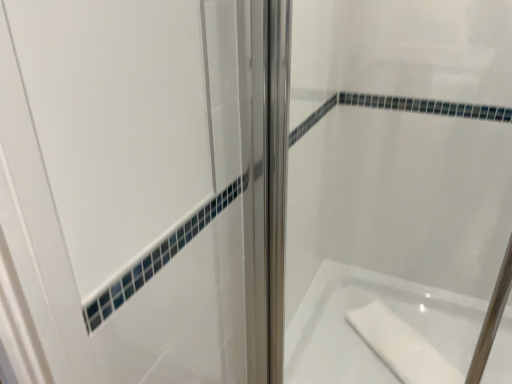
The height and width of the screenshot is (384, 512). What are the coordinates of `vacant space situated above white matte soap at lower right (from a real-world perspective)` in the screenshot? It's located at (399, 343).